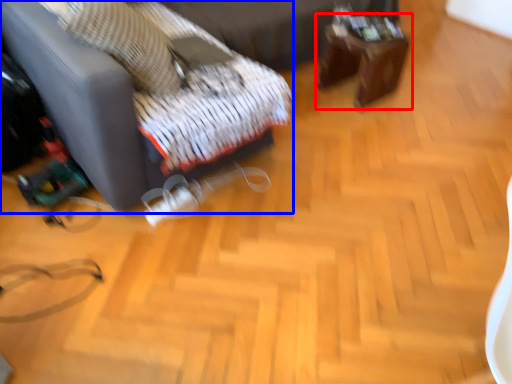
Question: Which object appears closest to the camera in this image, table (highlighted by a red box) or furniture (highlighted by a blue box)?

Choices:
 (A) table
 (B) furniture

Answer: (B)